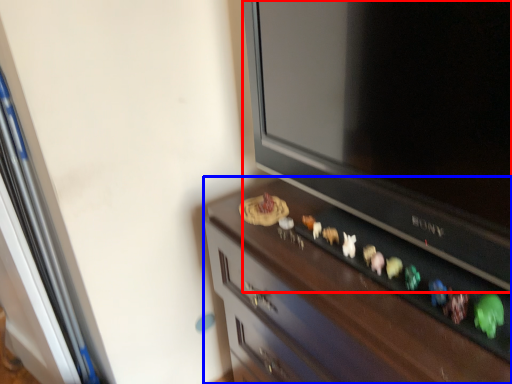
Question: Which object appears closest to the camera in this image, television (highlighted by a red box) or furniture (highlighted by a blue box)?

Choices:
 (A) television
 (B) furniture

Answer: (A)